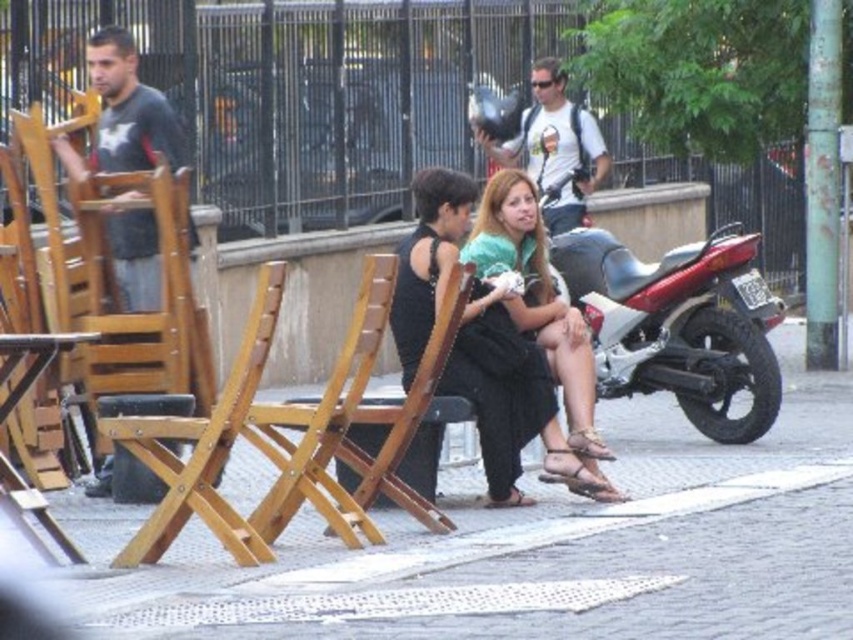
You are standing at the point marked by the coordinates point (521, 548) in the image. What type of surface are you currently standing on?

The point (521, 548) indicates smooth concrete pavement at center, so you are standing on smooth concrete pavement.

You are a delivery person trying to place a package on the smooth concrete pavement at center and the dark gray fabric shirt at left. Which surface can you place the package on without it being in the way of pedestrians?

The smooth concrete pavement at center can hold the package since it occupies less space than the dark gray fabric shirt at left, making it a better spot for placing items without obstructing pedestrian pathways.